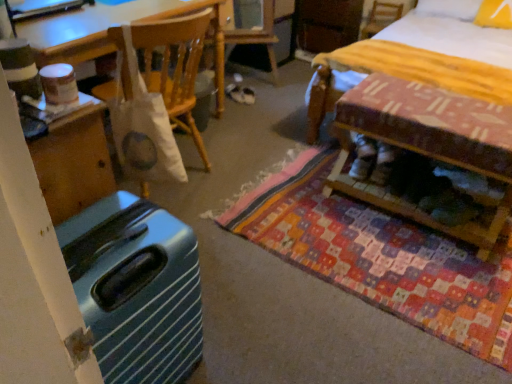
Identify the location of free space above teal glossy suitcase at lower left (from a real-world perspective). (110, 233).